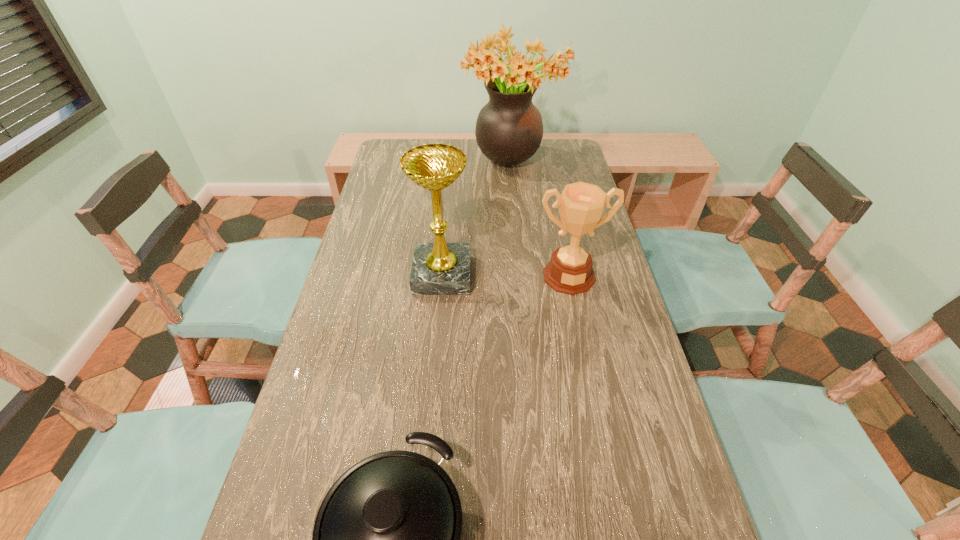
Image resolution: width=960 pixels, height=540 pixels. What are the coordinates of `flower arrangement present at the right edge` in the screenshot? It's located at (509, 129).

Where is `award positioned at the right edge`? The width and height of the screenshot is (960, 540). award positioned at the right edge is located at coordinates (581, 205).

At what (x,y) coordinates should I click in order to perform the action: click on object that is positioned at the far right corner. Please return your answer as a coordinate pair (x, y). Looking at the image, I should click on (509, 129).

Identify the location of free space at the far edge. This screenshot has width=960, height=540. (486, 157).

Locate an element on the screen. vacant space at the left edge is located at coordinates (390, 180).

Locate an element on the screen. This screenshot has width=960, height=540. vacant space at the right edge of the desktop is located at coordinates (621, 332).

The width and height of the screenshot is (960, 540). Find the location of `free space at the far right corner`. free space at the far right corner is located at coordinates (541, 154).

Where is `free spot between the shorter award and the tallest object`? free spot between the shorter award and the tallest object is located at coordinates (540, 220).

Find the location of `free space between the shorter award and the farthest object`. free space between the shorter award and the farthest object is located at coordinates (540, 220).

Find the location of a particular element. This screenshot has height=540, width=960. object that ranks as the second closest to the flower arrangement is located at coordinates (581, 205).